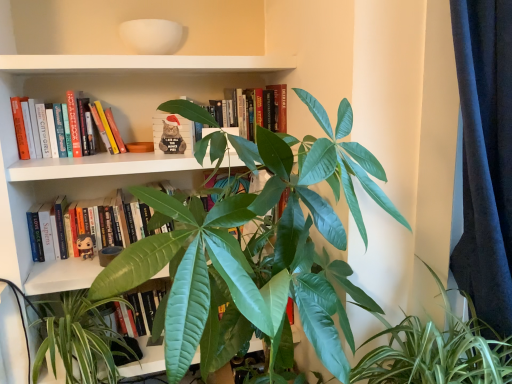
Question: Is point (189, 319) closer or farther from the camera than point (479, 342)?

Choices:
 (A) farther
 (B) closer

Answer: (B)

Question: Considering the positions of green glossy leafy plant at center, arranged as the 2th houseplant when viewed from the right, and green glossy leafy plant at center, the 1th houseplant in the right-to-left sequence, in the image, is green glossy leafy plant at center, arranged as the 2th houseplant when viewed from the right, bigger or smaller than green glossy leafy plant at center, the 1th houseplant in the right-to-left sequence,?

Choices:
 (A) big
 (B) small

Answer: (A)

Question: Considering the real-world distances, which object is farthest from the green glossy leafy plant at center, the 1th houseplant in the right-to-left sequence?

Choices:
 (A) hardcover book at center, which is the fourth book from top to bottom
 (B) green glossy leaf at lower center
 (C) hardcover book at center, the first book from the top
 (D) hardcover book at upper left, acting as the 3th book starting from the bottom
 (E) green glossy leafy plant at center, arranged as the 2th houseplant when viewed from the right

Answer: (D)

Question: Estimate the real-world distances between objects in this image. Which object is closer to the green glossy leaf at lower center?

Choices:
 (A) hardcover book at upper left, acting as the second book starting from the top
 (B) santa hat plush cat at center, the 3th book when ordered from top to bottom
 (C) hardcover book at center, the first book from the top
 (D) green glossy leafy plant at center, the 1th houseplant in the right-to-left sequence
 (E) hardcover book at center, which is the fourth book from top to bottom

Answer: (E)